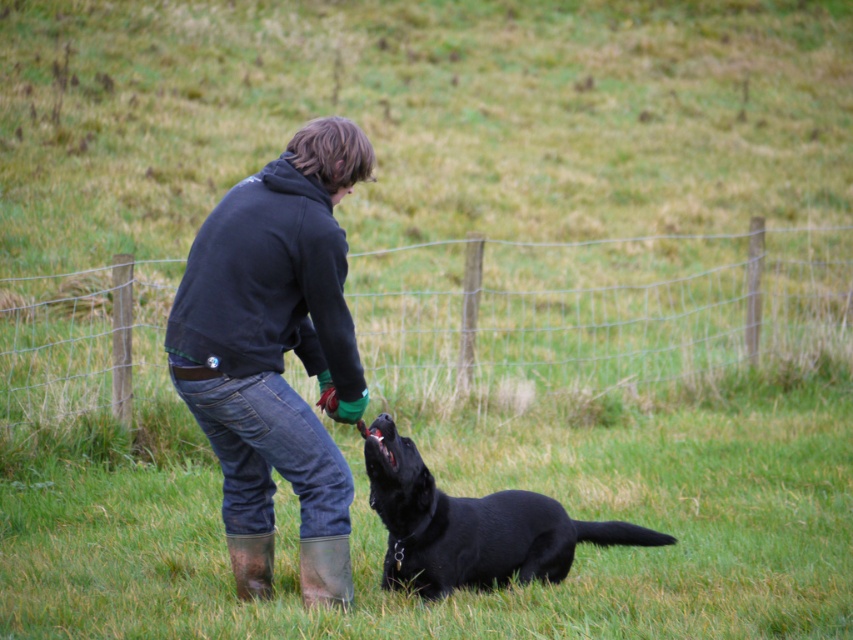
You are standing at point (276, 252) and want to reach the dog. The dog is 19.55 feet away from you. Can you throw a ball to the dog if the maximum distance you can throw is 20 feet?

Yes, you can throw the ball to the dog because the distance between you and the dog is 19.55 feet, which is within your maximum throwing range of 20 feet.

You are a photographer trying to capture a closeup of the black matte dog at lower center and the rubber boot at lower center. Since you want both subjects to be in focus, you need to know their positions relative to each other. Which object is positioned to the right side of the other?

The black matte dog at lower center is to the right of the rubber boot at lower center.

You are organizing a clothing donation drive and need to categorize the dark blue hoodie at center and the black cotton sweatshirt at center based on their size. Which one should you place in the large size bin?

The dark blue hoodie at center should be placed in the large size bin because its width is larger than the black cotton sweatshirt at center.